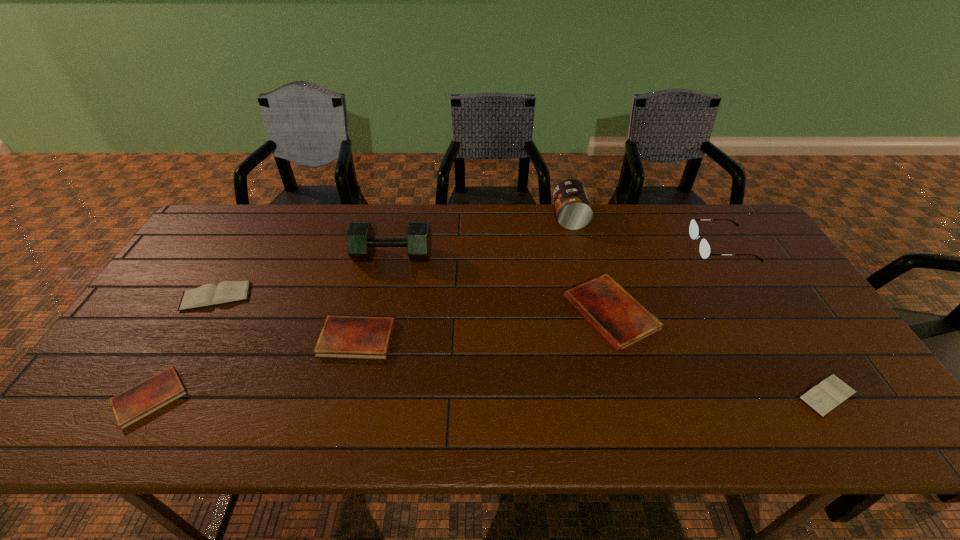
Image resolution: width=960 pixels, height=540 pixels. Find the location of `vacant space located 0.200m on the lenses of the black spectacles`. vacant space located 0.200m on the lenses of the black spectacles is located at coordinates (632, 246).

What are the coordinates of `vacant space positioned 0.200m on the left of the rightmost red diary` in the screenshot? It's located at (492, 313).

Find the location of a particular element. free space located 0.310m on the right of the bigger brown diary is located at coordinates (360, 296).

In order to click on free space located 0.140m on the right of the third diary from right to left in this screenshot , I will do `click(446, 338)`.

Image resolution: width=960 pixels, height=540 pixels. I want to click on vacant region located on the left of the nearer brown diary, so click(x=718, y=396).

The image size is (960, 540). I want to click on vacant space located on the back of the nearest red diary, so click(185, 339).

The width and height of the screenshot is (960, 540). Identify the location of can that is at the far edge. (573, 209).

I want to click on dumbbell positioned at the far edge, so click(361, 242).

You are a GUI agent. You are given a task and a screenshot of the screen. Output one action in this format:
    pyautogui.click(x=<x>, y=<y>)
    Task: Click on the spectacles that is positioned at the far edge
    This screenshot has width=960, height=540.
    Given the screenshot: What is the action you would take?
    pyautogui.click(x=705, y=250)

Identify the location of spectacles that is at the right edge. The image size is (960, 540). (705, 250).